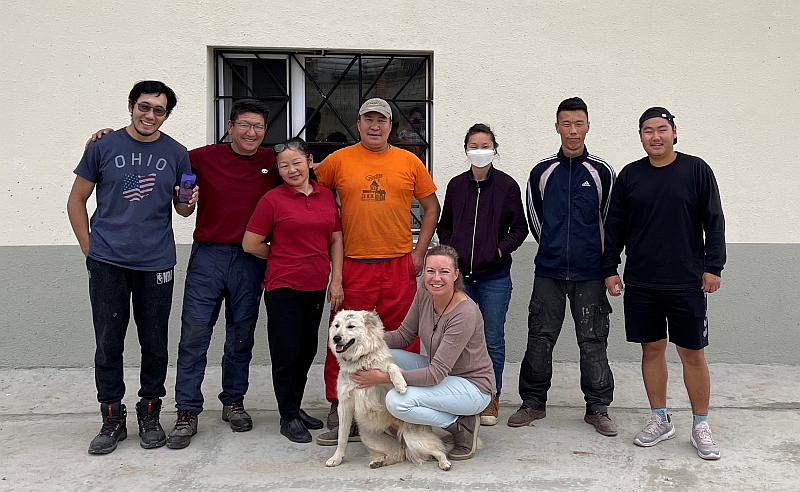
This screenshot has height=492, width=800. Find the location of `black bars on window`. black bars on window is located at coordinates (324, 100), (277, 100).